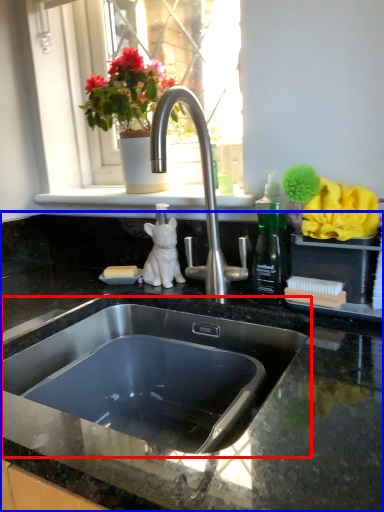
Question: Among these objects, which one is nearest to the camera, sink (highlighted by a red box) or countertop (highlighted by a blue box)?

Choices:
 (A) sink
 (B) countertop

Answer: (B)